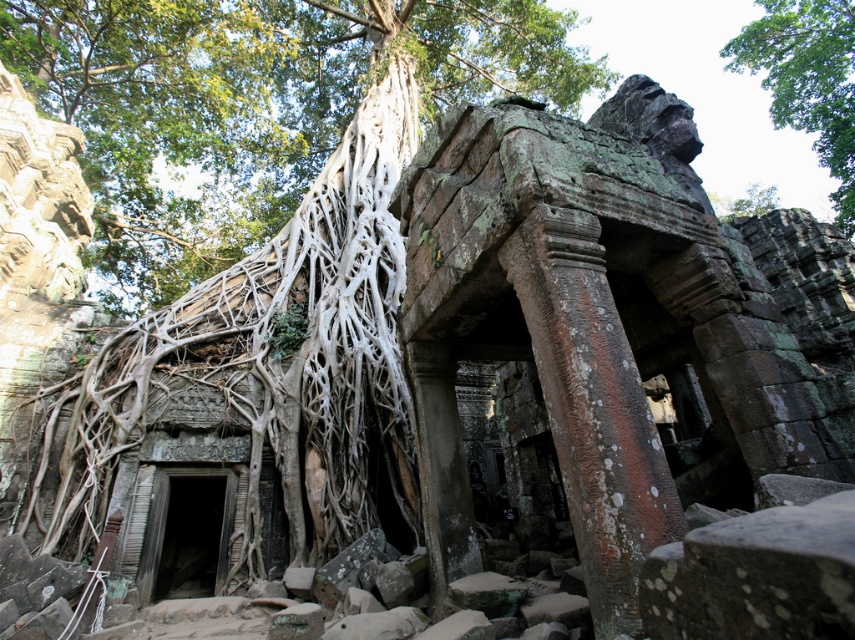
Question: Which object is closer to the camera taking this photo?

Choices:
 (A) green leafy tree at upper center
 (B) white root at left

Answer: (B)

Question: Which point is farther from the camera taking this photo?

Choices:
 (A) (136, 102)
 (B) (850, 163)

Answer: (B)

Question: Is white root at left to the right of green leafy tree at upper center from the viewer's perspective?

Choices:
 (A) no
 (B) yes

Answer: (A)

Question: Which point is closer to the camera taking this photo?

Choices:
 (A) (166, 145)
 (B) (777, 13)

Answer: (A)

Question: Is white root at left positioned in front of green leafy tree at upper center?

Choices:
 (A) yes
 (B) no

Answer: (A)

Question: Observing the image, what is the correct spatial positioning of white root at left in reference to green leafy tree at upper center?

Choices:
 (A) below
 (B) above

Answer: (A)